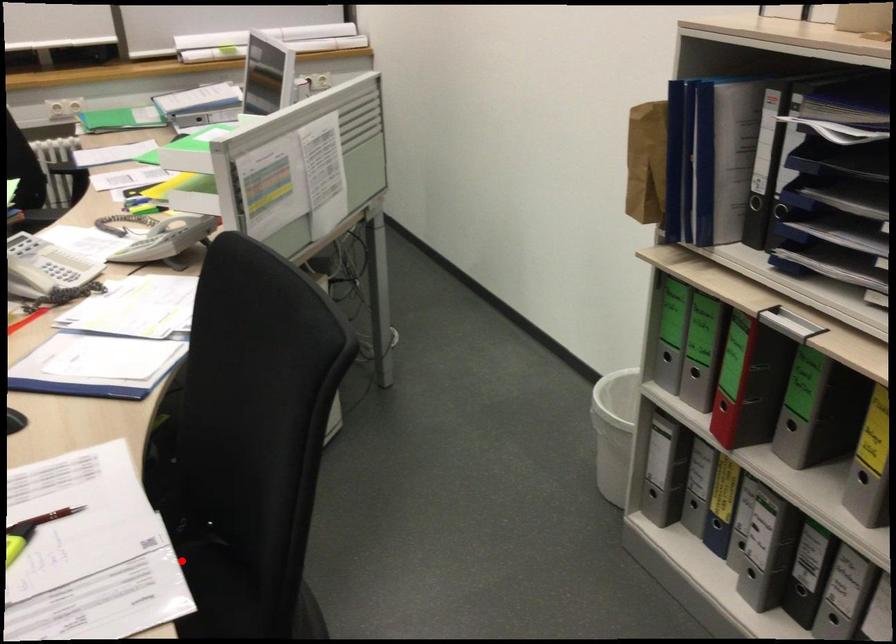
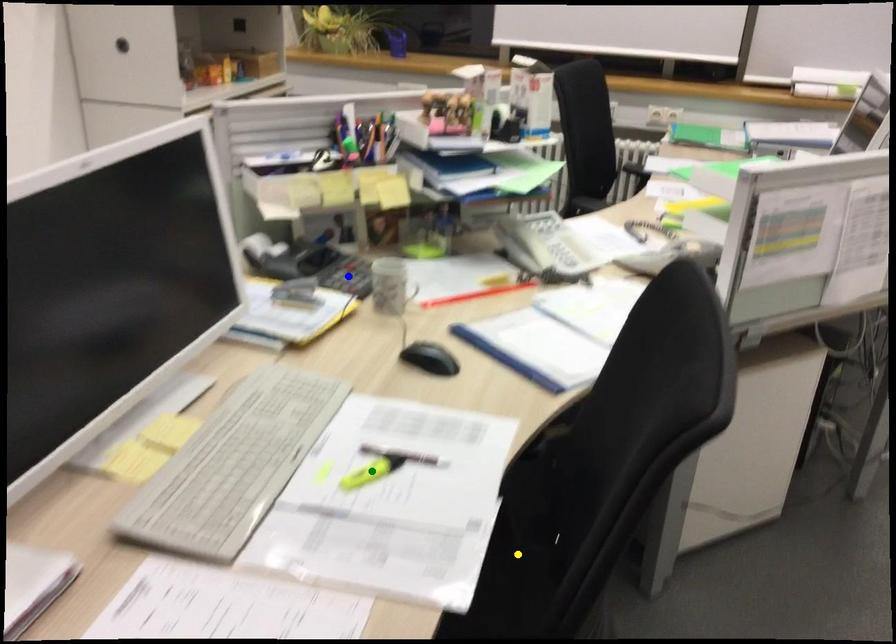
Question: I am providing you with two images of the same scene from different viewpoints. A red point is marked on the first image. You are given multiple points on the second image. Which mark in image 2 goes with the point in image 1?

Choices:
 (A) blue point
 (B) yellow point
 (C) green point

Answer: (B)